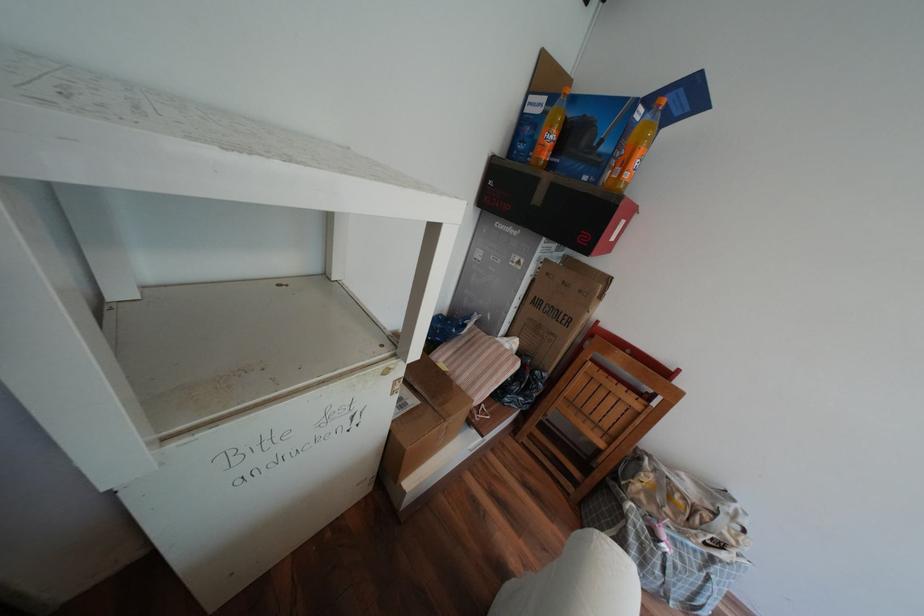
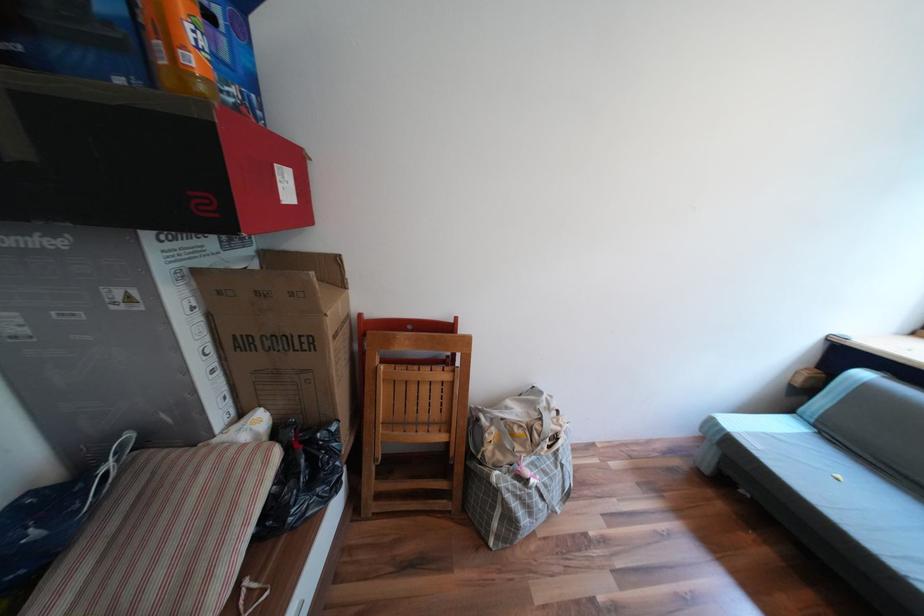
Locate, in the second image, the point that corresponds to pixel 531 297 in the first image.

(219, 349)